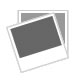
I want to click on dark grey picture, so click(43, 38).